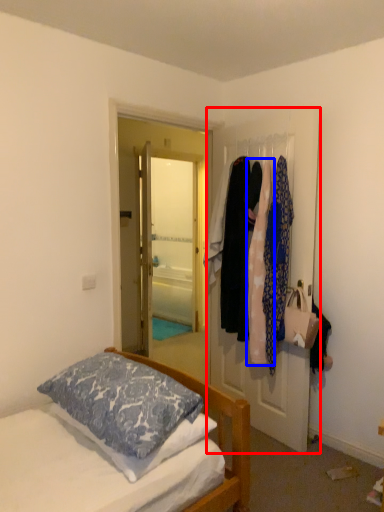
Question: Which of the following is the farthest to the observer, door (highlighted by a red box) or clothing (highlighted by a blue box)?

Choices:
 (A) door
 (B) clothing

Answer: (B)